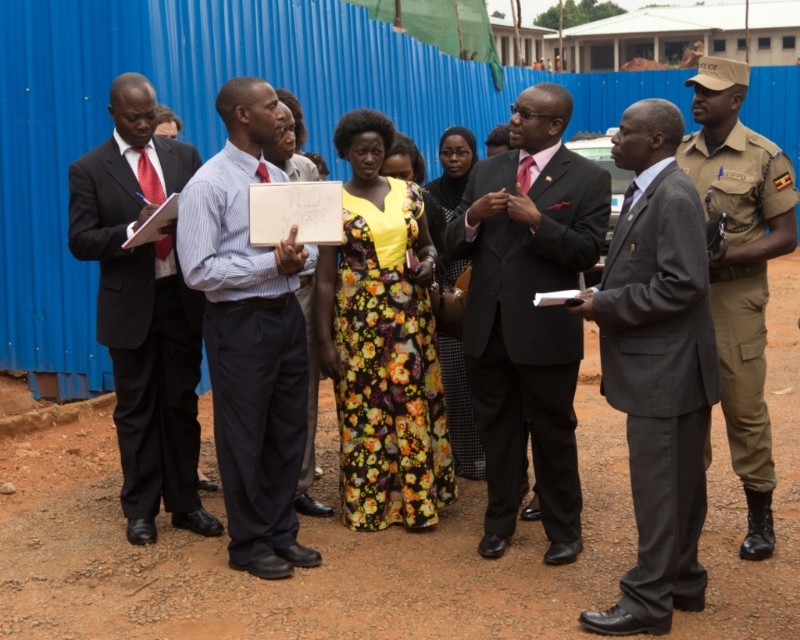
Question: Which point is farther to the camera?

Choices:
 (A) (548, 204)
 (B) (272, 307)
 (C) (656, 179)

Answer: (A)

Question: Does black suit at left lie in front of khaki uniform at right?

Choices:
 (A) yes
 (B) no

Answer: (B)

Question: Considering the relative positions of dark gray suit at center and blue striped shirt at center in the image provided, where is dark gray suit at center located with respect to blue striped shirt at center?

Choices:
 (A) left
 (B) right

Answer: (B)

Question: Based on their relative distances, which object is farther from the black suit at left?

Choices:
 (A) khaki uniform at right
 (B) floral print dress at center
 (C) light blue shirt at center

Answer: (A)

Question: Is matte black suit at center closer to the viewer compared to dark gray suit at center?

Choices:
 (A) yes
 (B) no

Answer: (B)

Question: Among these objects, which one is nearest to the camera?

Choices:
 (A) floral fabric dress at center
 (B) khaki uniform at right
 (C) floral print dress at center
 (D) matte black suit at center

Answer: (B)